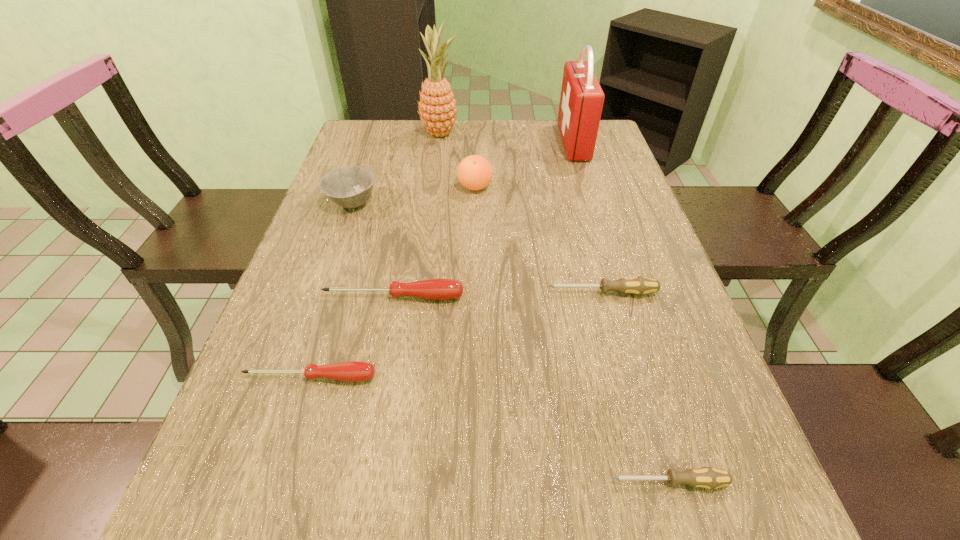
At what (x,y) coordinates should I click in order to perform the action: click on pineapple. Please return your answer as a coordinate pair (x, y). The image size is (960, 540). Looking at the image, I should click on (437, 107).

The height and width of the screenshot is (540, 960). Find the location of `the second tallest object`. the second tallest object is located at coordinates (581, 101).

Find the location of a particular element. red first-aid kit is located at coordinates (581, 101).

Identify the location of orange. This screenshot has height=540, width=960. (474, 172).

The height and width of the screenshot is (540, 960). Identify the location of orange orange. (474, 172).

Find the location of a particular element. The image size is (960, 540). the fourth tallest object is located at coordinates (350, 186).

Find the location of a particular element. Image resolution: width=960 pixels, height=540 pixels. the bigger red screwdriver is located at coordinates (435, 289).

Where is `the bigger gray screwdriver`? This screenshot has width=960, height=540. the bigger gray screwdriver is located at coordinates (638, 285).

You are a GUI agent. You are given a task and a screenshot of the screen. Output one action in this format:
    pyautogui.click(x=<x>, y=<y>)
    Task: Click on the second nearest screwdriver
    
    Given the screenshot: What is the action you would take?
    pyautogui.click(x=353, y=371)

The image size is (960, 540). Identify the location of the nearer red screwdriver. (353, 371).